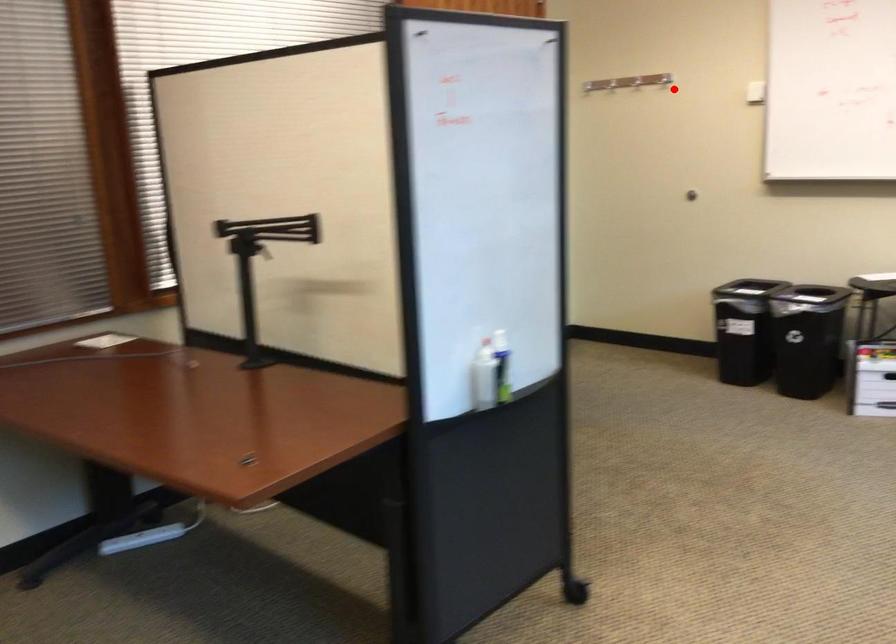
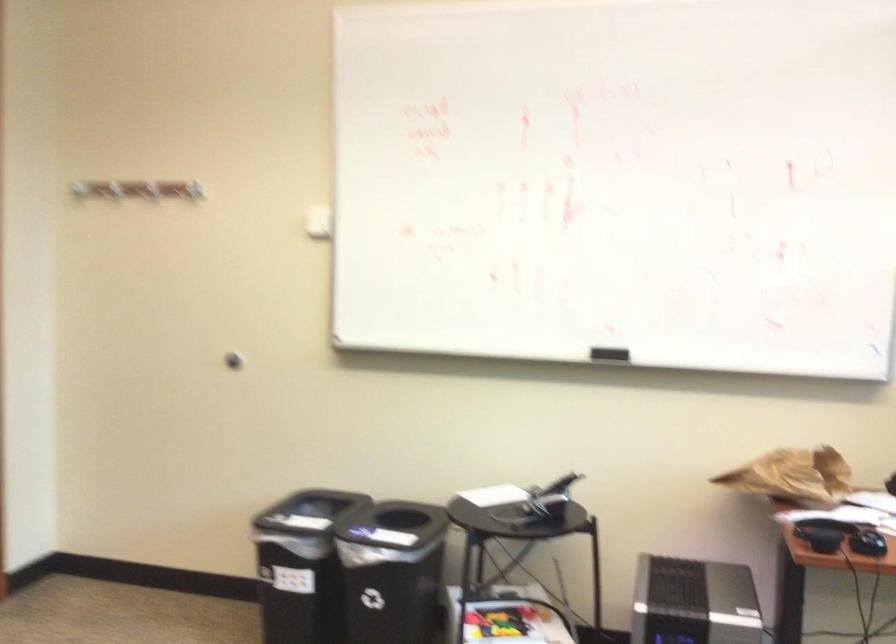
Question: A red point is marked in image1. In image2, is the corresponding 3D point closer to the camera or farther? Reply with the corresponding letter.

Choices:
 (A) The corresponding 3D point is closer.
 (B) The corresponding 3D point is farther.

Answer: (A)